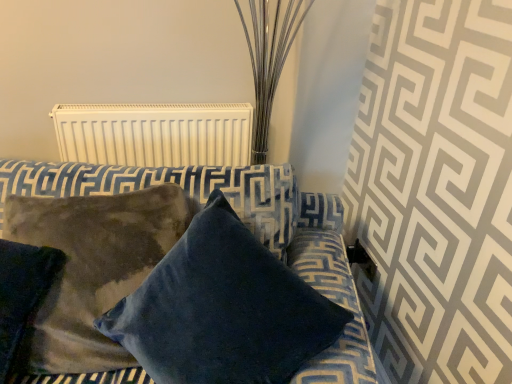
Question: From the image's perspective, is white matte radiator at upper center located beneath velvet blue pillow at center, which ranks as the 2th pillow in left-to-right order?

Choices:
 (A) no
 (B) yes

Answer: (A)

Question: Is there a large distance between white matte radiator at upper center and velvet blue pillow at center, which ranks as the 2th pillow in left-to-right order?

Choices:
 (A) yes
 (B) no

Answer: (B)

Question: Is white matte radiator at upper center bigger than velvet blue pillow at center, which ranks as the 2th pillow in left-to-right order?

Choices:
 (A) yes
 (B) no

Answer: (B)

Question: Could you tell me if white matte radiator at upper center is facing velvet blue pillow at center, which ranks as the 2th pillow in left-to-right order?

Choices:
 (A) no
 (B) yes

Answer: (B)

Question: From a real-world perspective, is white matte radiator at upper center under velvet blue pillow at center, arranged as the first pillow when viewed from the right?

Choices:
 (A) no
 (B) yes

Answer: (A)

Question: Considering the relative positions of suede-like brown pillow at lower left, which is counted as the second pillow, starting from the right, and white matte radiator at upper center in the image provided, is suede-like brown pillow at lower left, which is counted as the second pillow, starting from the right, to the left or to the right of white matte radiator at upper center?

Choices:
 (A) left
 (B) right

Answer: (A)

Question: From a real-world perspective, relative to white matte radiator at upper center, is suede-like brown pillow at lower left, placed as the first pillow when sorted from left to right, vertically above or below?

Choices:
 (A) below
 (B) above

Answer: (A)

Question: In the image, is suede-like brown pillow at lower left, placed as the first pillow when sorted from left to right, positioned in front of or behind white matte radiator at upper center?

Choices:
 (A) front
 (B) behind

Answer: (A)

Question: Considering the positions of point [38, 299] and point [109, 152], is point [38, 299] closer or farther from the camera than point [109, 152]?

Choices:
 (A) farther
 (B) closer

Answer: (B)

Question: Relative to suede-like brown pillow at lower left, which is counted as the second pillow, starting from the right, is velvet blue pillow at center, which ranks as the 2th pillow in left-to-right order, in front or behind?

Choices:
 (A) behind
 (B) front

Answer: (B)

Question: From the image's perspective, is velvet blue pillow at center, which ranks as the 2th pillow in left-to-right order, above or below suede-like brown pillow at lower left, placed as the first pillow when sorted from left to right?

Choices:
 (A) above
 (B) below

Answer: (B)

Question: Which is correct: velvet blue pillow at center, which ranks as the 2th pillow in left-to-right order, is inside suede-like brown pillow at lower left, which is counted as the second pillow, starting from the right, or outside of it?

Choices:
 (A) outside
 (B) inside

Answer: (A)

Question: Is velvet blue pillow at center, which ranks as the 2th pillow in left-to-right order, bigger or smaller than suede-like brown pillow at lower left, placed as the first pillow when sorted from left to right?

Choices:
 (A) small
 (B) big

Answer: (B)

Question: Is white matte radiator at upper center spatially inside velvet blue pillow at center, which ranks as the 2th pillow in left-to-right order, or outside of it?

Choices:
 (A) inside
 (B) outside

Answer: (B)

Question: Looking at their shapes, would you say white matte radiator at upper center is wider or thinner than velvet blue pillow at center, arranged as the first pillow when viewed from the right?

Choices:
 (A) thin
 (B) wide

Answer: (A)